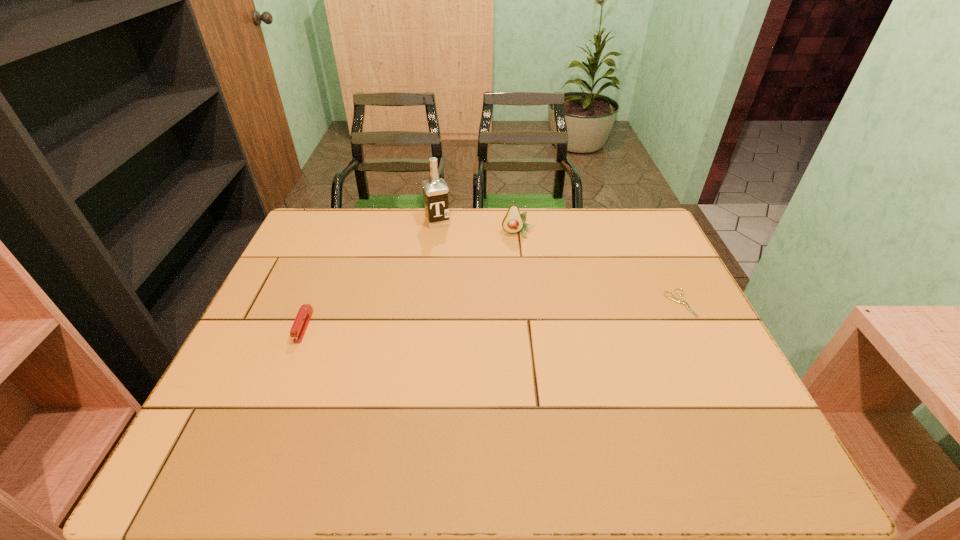
The height and width of the screenshot is (540, 960). In order to click on free area in between the third shortest object and the shears in this screenshot , I will do `click(599, 268)`.

Find the location of a particular element. This screenshot has height=540, width=960. free space between the rightmost object and the avocado is located at coordinates (599, 268).

The height and width of the screenshot is (540, 960). Find the location of `empty space between the tallest object and the rightmost object`. empty space between the tallest object and the rightmost object is located at coordinates (559, 262).

Find the location of a particular element. The image size is (960, 540). vacant area between the second shortest object and the shears is located at coordinates (492, 315).

Locate an element on the screen. free space that is in between the shears and the stapler is located at coordinates (492, 315).

Locate an element on the screen. object that is the third closest to the shortest object is located at coordinates (303, 317).

Identify the location of object that is the third closest to the shears. The width and height of the screenshot is (960, 540). (303, 317).

This screenshot has width=960, height=540. I want to click on vacant space that satisfies the following two spatial constraints: 1. on the front side of the rightmost object; 2. on the right side of the second tallest object, so click(x=526, y=303).

At what (x,y) coordinates should I click in order to perform the action: click on blank area in the image that satisfies the following two spatial constraints: 1. on the front side of the third shortest object; 2. on the right side of the shears. Please return your answer as a coordinate pair (x, y). Looking at the image, I should click on (526, 303).